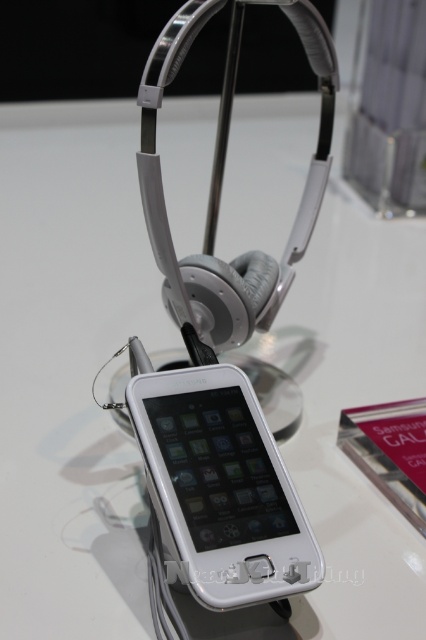
Question: Is white glossy ipod at center wider than satin silver headphones at upper center?

Choices:
 (A) yes
 (B) no

Answer: (B)

Question: Is white glossy ipod at center above satin silver headphones at upper center?

Choices:
 (A) yes
 (B) no

Answer: (B)

Question: Can you confirm if white glossy ipod at center is bigger than satin silver headphones at upper center?

Choices:
 (A) no
 (B) yes

Answer: (A)